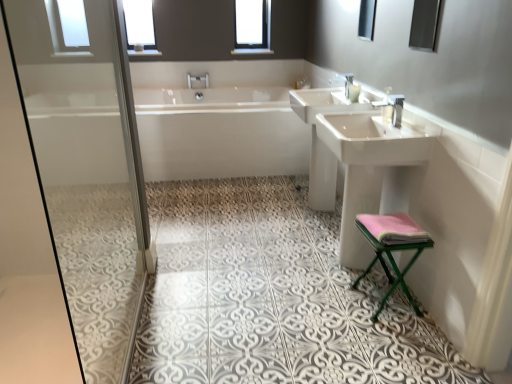
Question: Could you tell me if pink fabric towel at lower right is facing clear glass window at upper center, the 1th window from the right?

Choices:
 (A) no
 (B) yes

Answer: (A)

Question: Does pink fabric towel at lower right have a greater width compared to clear glass window at upper center, the 1th window from the right?

Choices:
 (A) yes
 (B) no

Answer: (A)

Question: Does pink fabric towel at lower right have a lesser height compared to clear glass window at upper center, marked as the 2th window in a left-to-right arrangement?

Choices:
 (A) no
 (B) yes

Answer: (B)

Question: Is pink fabric towel at lower right at the left side of clear glass window at upper center, the 1th window from the right?

Choices:
 (A) no
 (B) yes

Answer: (A)

Question: Is the depth of pink fabric towel at lower right greater than that of clear glass window at upper center, marked as the 2th window in a left-to-right arrangement?

Choices:
 (A) yes
 (B) no

Answer: (B)

Question: From the image's perspective, is pink fabric towel at lower right above clear glass window at upper center, marked as the 2th window in a left-to-right arrangement?

Choices:
 (A) no
 (B) yes

Answer: (A)

Question: Is pink fabric stool at lower right completely or partially outside of silver metallic tap at upper center, positioned as the 2th tap in top-to-bottom order?

Choices:
 (A) no
 (B) yes

Answer: (B)

Question: Is pink fabric stool at lower right at the left side of silver metallic tap at upper center, which ranks as the 2th tap in left-to-right order?

Choices:
 (A) yes
 (B) no

Answer: (A)

Question: Is pink fabric stool at lower right further to camera compared to silver metallic tap at upper center, which is the 1th tap in bottom-to-top order?

Choices:
 (A) yes
 (B) no

Answer: (B)

Question: Would you say pink fabric stool at lower right contains silver metallic tap at upper center, the 1th tap in the right-to-left sequence?

Choices:
 (A) yes
 (B) no

Answer: (B)

Question: Is pink fabric stool at lower right oriented away from silver metallic tap at upper center, which appears as the second tap when viewed from the back?

Choices:
 (A) yes
 (B) no

Answer: (B)

Question: Can you confirm if pink fabric stool at lower right is bigger than silver metallic tap at upper center, which is the 1th tap in bottom-to-top order?

Choices:
 (A) yes
 (B) no

Answer: (A)

Question: Is white glossy bathtub at center not within pink fabric towel at lower right?

Choices:
 (A) no
 (B) yes

Answer: (B)